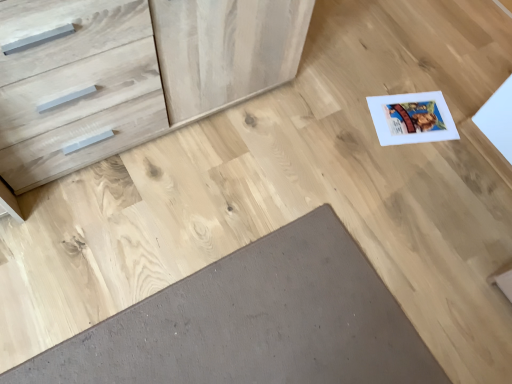
The image size is (512, 384). In order to click on free space underneath brown matte doormat at lower center (from a real-world perspective) in this screenshot , I will do `click(266, 327)`.